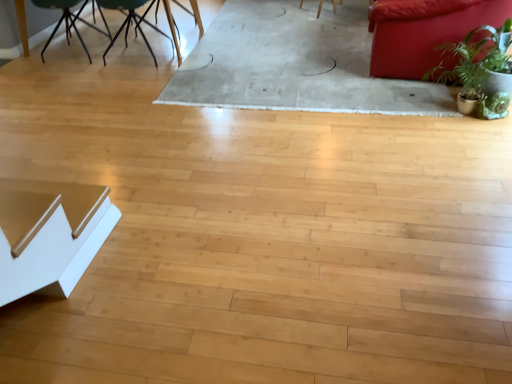
Find the location of `free space in front of green leafy plant at right`. free space in front of green leafy plant at right is located at coordinates (462, 137).